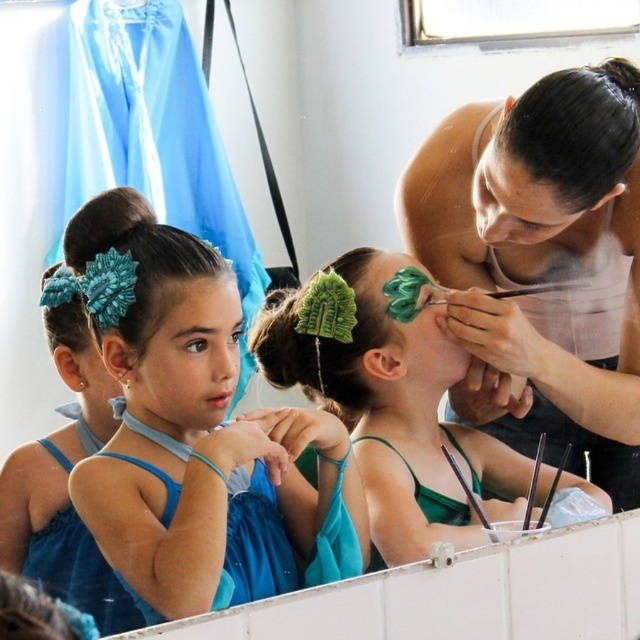
You are a costume designer checking the placement of the matte blue fabric at center and the teal fabric flower at center in the dressing room scene. Which fabric is placed lower in the image?

The matte blue fabric at center is positioned under the teal fabric flower at center, so the matte blue fabric at center is placed lower in the image.

You are a costume designer preparing for a performance. You need to ensure that all hair accessories are visible in the mirror. Given the black shiny hair at upper right and the teal fabric flower at center, which accessory is shorter and might need adjustment to be seen better in the reflection?

The black shiny hair at upper right is not as tall as the teal fabric flower at center, so it might need adjustment to be seen better in the reflection.

You are a costume designer preparing for a performance. You need to decide which of the two accessories, the black shiny hair at upper right or the green fabric flower at center, is more suitable for a leading role. Based on their sizes, which accessory would you choose and why?

The green fabric flower at center is larger than the black shiny hair at upper right, so it would be more suitable for a leading role as it can draw more attention due to its size.